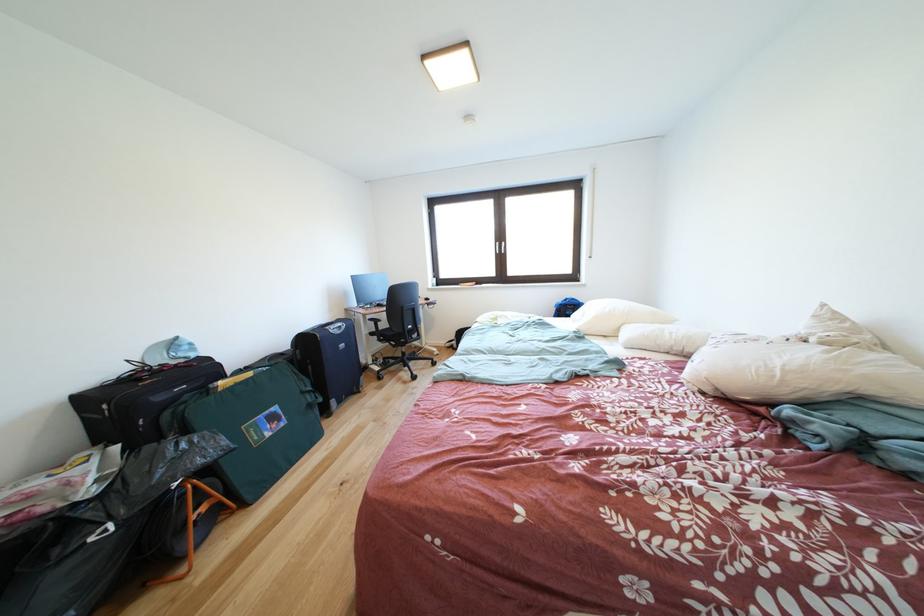
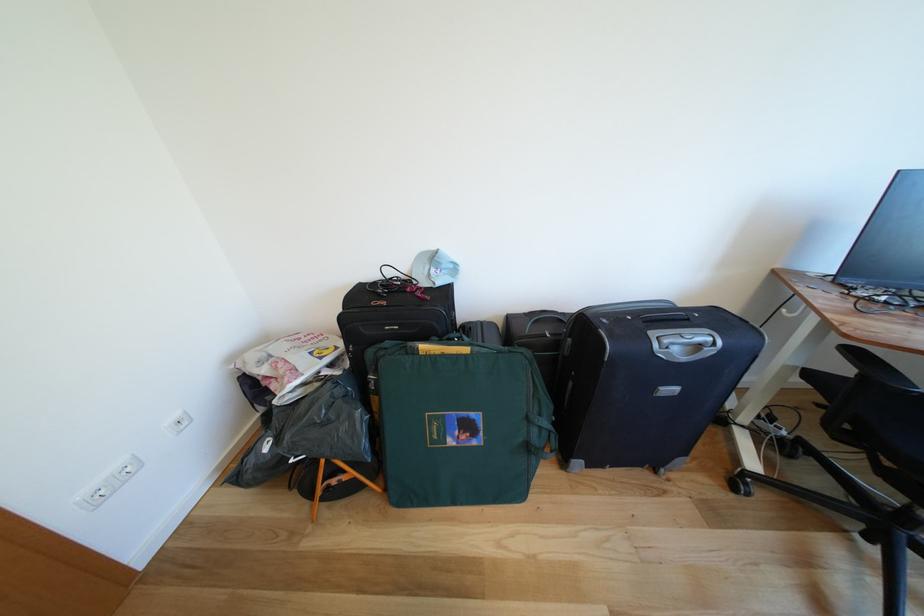
Locate, in the second image, the point that corresponds to [348,331] in the first image.

(707, 351)